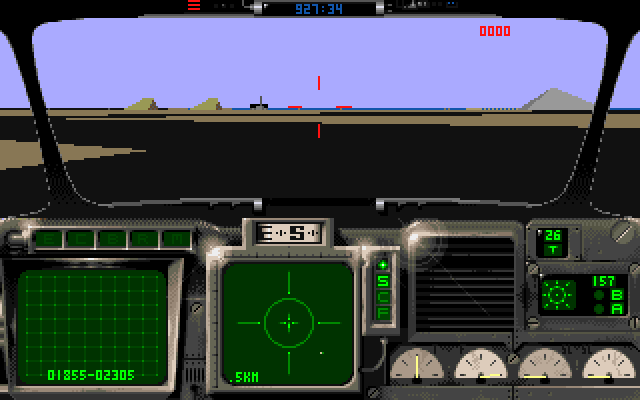
Find the location of a particular element. The width and height of the screenshot is (640, 400). blue digital clock is located at coordinates (307, 11).